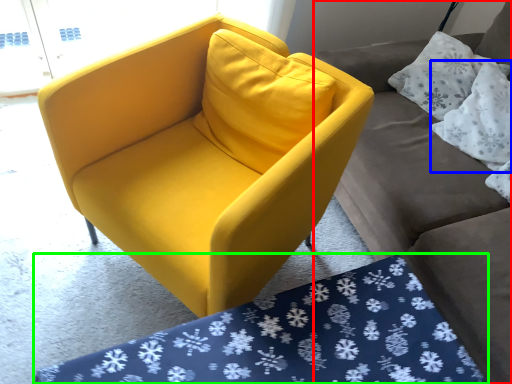
Question: Estimate the real-world distances between objects in this image. Which object is farther from studio couch (highlighted by a red box), pillow (highlighted by a blue box) or mat (highlighted by a green box)?

Choices:
 (A) pillow
 (B) mat

Answer: (B)